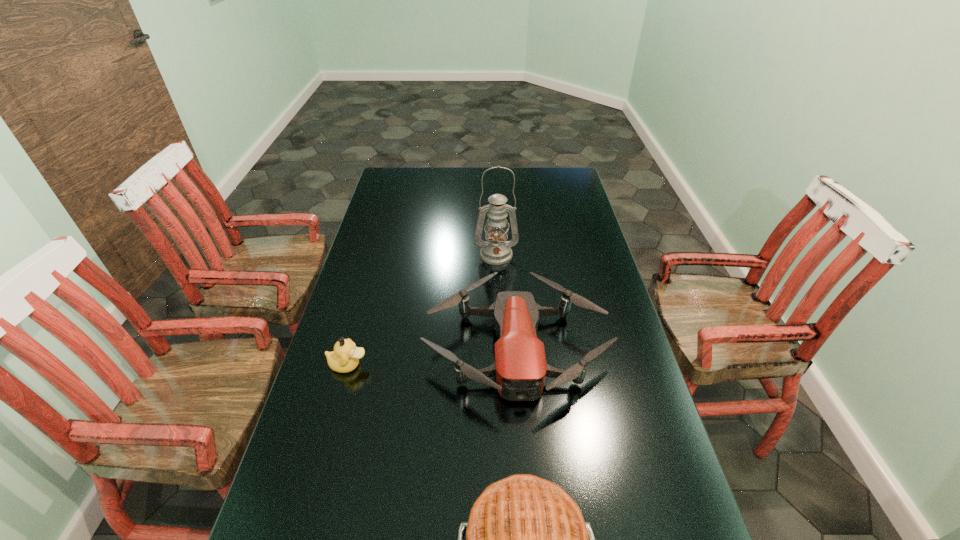
Image resolution: width=960 pixels, height=540 pixels. In order to click on vacant space at the left edge of the desktop in this screenshot , I will do `click(392, 215)`.

Locate an element on the screen. free space at the right edge of the desktop is located at coordinates (643, 431).

This screenshot has width=960, height=540. Find the location of `vacant space at the far left corner of the desktop`. vacant space at the far left corner of the desktop is located at coordinates (379, 192).

Find the location of a particular element. The image size is (960, 540). vacant area that lies between the drone and the duckling is located at coordinates (432, 356).

Find the location of `free area in between the oil lamp and the leftmost object`. free area in between the oil lamp and the leftmost object is located at coordinates (422, 310).

Find the location of a particular element. This screenshot has width=960, height=540. empty space that is in between the drone and the duckling is located at coordinates (432, 356).

Locate an element on the screen. The image size is (960, 540). vacant space in between the leftmost object and the farthest object is located at coordinates (422, 310).

Identify the location of empty space between the duckling and the drone. The width and height of the screenshot is (960, 540). pos(432,356).

At what (x,y) coordinates should I click in order to perform the action: click on free spot between the farthest object and the duckling. Please return your answer as a coordinate pair (x, y). Image resolution: width=960 pixels, height=540 pixels. Looking at the image, I should click on (422, 310).

Select which object appears as the closest to the oil lamp. Please provide its 2D coordinates. Your answer should be formatted as a tuple, i.e. [(x, y)], where the tuple contains the x and y coordinates of a point satisfying the conditions above.

[(520, 368)]